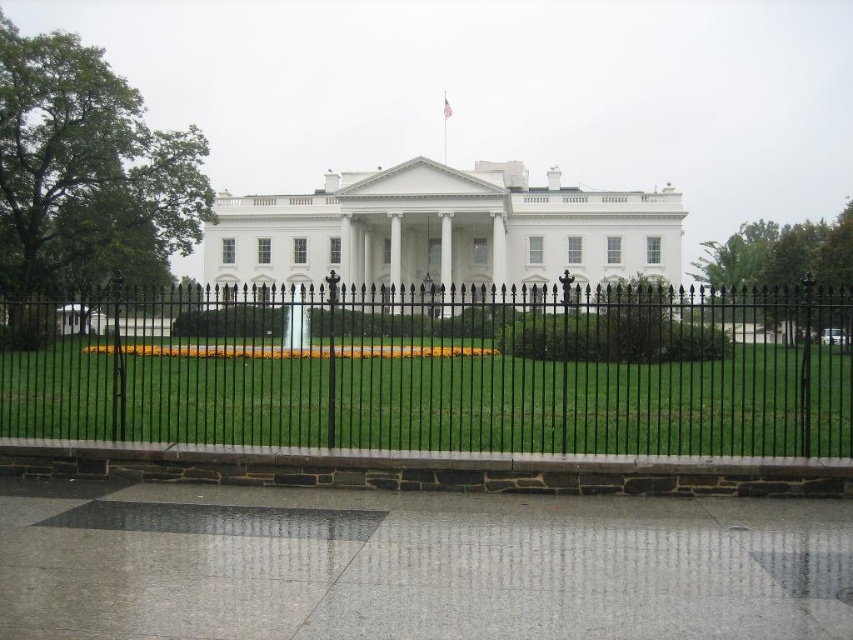
Is black wrought iron fence at center to the right of gray polished concrete at lower center from the viewer's perspective?

Incorrect, black wrought iron fence at center is not on the right side of gray polished concrete at lower center.

Can you confirm if black wrought iron fence at center is shorter than gray polished concrete at lower center?

No, black wrought iron fence at center is not shorter than gray polished concrete at lower center.

Between point (142, 342) and point (627, 500), which one is positioned behind?

The point (142, 342) is more distant.

Where is `black wrought iron fence at center`? Image resolution: width=853 pixels, height=640 pixels. black wrought iron fence at center is located at coordinates (447, 374).